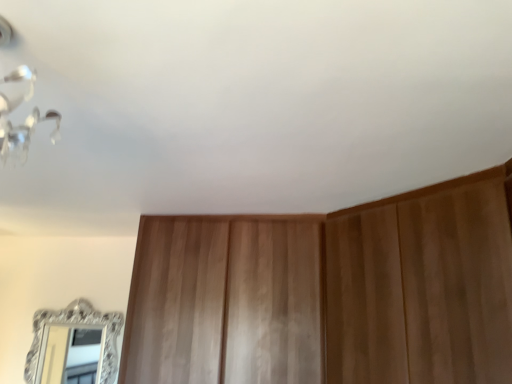
Question: Looking at the image, does silver ornate mirror at lower left seem bigger or smaller compared to wooden dresser at center?

Choices:
 (A) big
 (B) small

Answer: (B)

Question: Is silver ornate mirror at lower left wider or thinner than wooden dresser at center?

Choices:
 (A) wide
 (B) thin

Answer: (B)

Question: Is silver ornate mirror at lower left in front of or behind wooden dresser at center in the image?

Choices:
 (A) front
 (B) behind

Answer: (B)

Question: From their relative heights in the image, would you say wooden dresser at center is taller or shorter than silver ornate mirror at lower left?

Choices:
 (A) tall
 (B) short

Answer: (A)

Question: From the image's perspective, is wooden dresser at center located above or below silver ornate mirror at lower left?

Choices:
 (A) above
 (B) below

Answer: (A)

Question: Looking at their shapes, would you say wooden dresser at center is wider or thinner than silver ornate mirror at lower left?

Choices:
 (A) wide
 (B) thin

Answer: (A)

Question: Considering the positions of point (470, 230) and point (116, 332), is point (470, 230) closer or farther from the camera than point (116, 332)?

Choices:
 (A) closer
 (B) farther

Answer: (A)